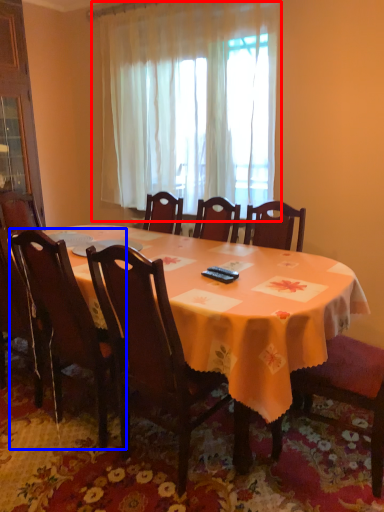
Question: Which point is closer to the camera, curtain (highlighted by a red box) or chair (highlighted by a blue box)?

Choices:
 (A) curtain
 (B) chair

Answer: (B)